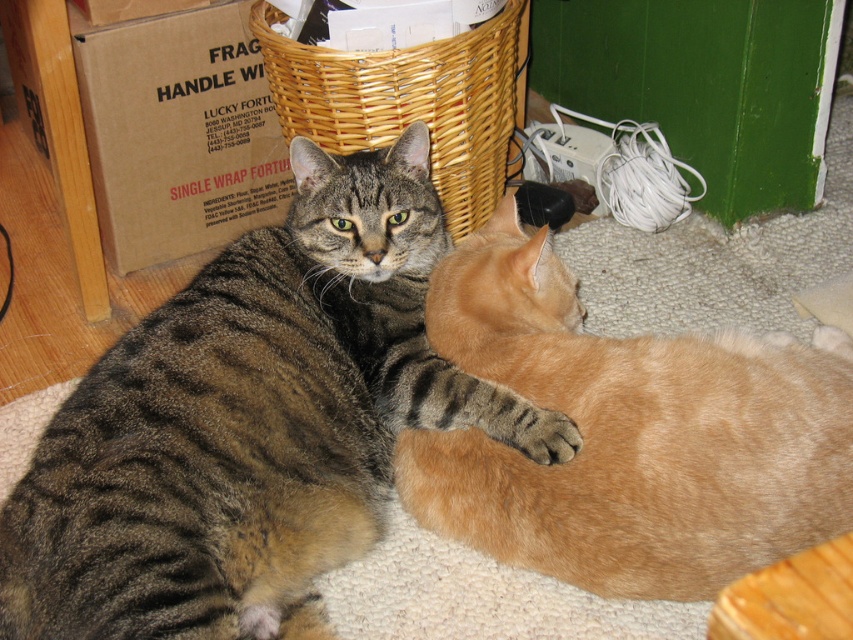
Does brown cardboard box at upper left appear on the left side of woven brown basket at upper center?

Indeed, brown cardboard box at upper left is positioned on the left side of woven brown basket at upper center.

Can you confirm if brown cardboard box at upper left is positioned to the right of woven brown basket at upper center?

No, brown cardboard box at upper left is not to the right of woven brown basket at upper center.

Which is in front, point (134, 256) or point (312, 86)?

Point (312, 86) is in front.

What are the coordinates of `brown cardboard box at upper left` in the screenshot? It's located at (178, 132).

Does woven brown basket at upper center appear on the left side of soft fur paw at lower center?

Correct, you'll find woven brown basket at upper center to the left of soft fur paw at lower center.

Between point (450, 200) and point (576, 429), which one is positioned in front?

Positioned in front is point (576, 429).

What do you see at coordinates (407, 102) in the screenshot?
I see `woven brown basket at upper center` at bounding box center [407, 102].

You are a GUI agent. You are given a task and a screenshot of the screen. Output one action in this format:
    pyautogui.click(x=<x>, y=<y>)
    Task: Click on the woven brown basket at upper center
    The height and width of the screenshot is (640, 853).
    Given the screenshot: What is the action you would take?
    pyautogui.click(x=407, y=102)

Between tabby fur cat at center and soft fur paw at lower center, which one is positioned higher?

tabby fur cat at center is higher up.

Is point (184, 474) positioned in front of point (552, 419)?

Yes, it is in front of point (552, 419).

At what (x,y) coordinates should I click in order to perform the action: click on tabby fur cat at center. Please return your answer as a coordinate pair (x, y). The height and width of the screenshot is (640, 853). Looking at the image, I should click on (245, 422).